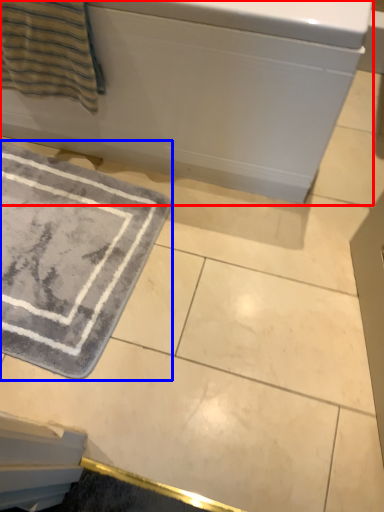
Question: Which object is further to the camera taking this photo, bath (highlighted by a red box) or bath mat (highlighted by a blue box)?

Choices:
 (A) bath
 (B) bath mat

Answer: (B)